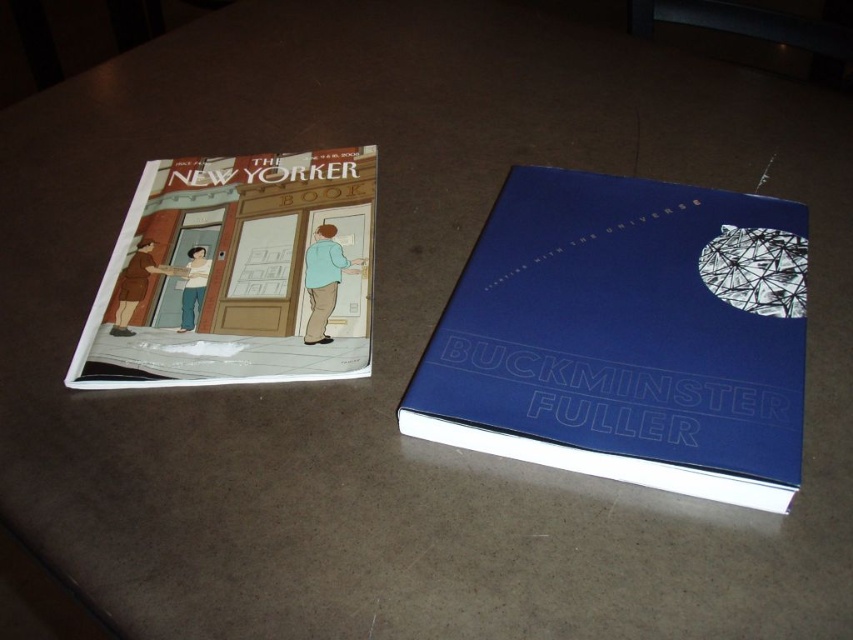
You are trying to locate the blue hardcover book at center on a table. What are its coordinates?

The blue hardcover book at center is located at coordinates point (625, 337).

Looking at this image, you are organizing books on a shelf and need to place the blue hardcover book at center and the matte paper book at left. Based on their positions in the image, which book should you place closer to the front of the shelf?

The blue hardcover book at center should be placed closer to the front of the shelf because it is in front of the matte paper book at left in the image.